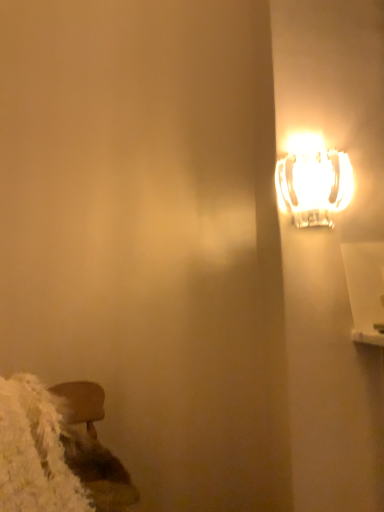
Question: Considering the relative sizes of wooden stool at lower left and translucent glass lamp at upper right in the image provided, is wooden stool at lower left wider than translucent glass lamp at upper right?

Choices:
 (A) yes
 (B) no

Answer: (A)

Question: Is wooden stool at lower left closer to camera compared to translucent glass lamp at upper right?

Choices:
 (A) yes
 (B) no

Answer: (A)

Question: Is wooden stool at lower left located outside translucent glass lamp at upper right?

Choices:
 (A) no
 (B) yes

Answer: (B)

Question: Is wooden stool at lower left bigger than translucent glass lamp at upper right?

Choices:
 (A) yes
 (B) no

Answer: (A)

Question: Can you confirm if wooden stool at lower left is smaller than translucent glass lamp at upper right?

Choices:
 (A) no
 (B) yes

Answer: (A)

Question: Is wooden stool at lower left not close to translucent glass lamp at upper right?

Choices:
 (A) yes
 (B) no

Answer: (B)

Question: Considering the relative sizes of translucent glass lamp at upper right and wooden stool at lower left in the image provided, is translucent glass lamp at upper right taller than wooden stool at lower left?

Choices:
 (A) yes
 (B) no

Answer: (B)

Question: Can wooden stool at lower left be found inside translucent glass lamp at upper right?

Choices:
 (A) no
 (B) yes

Answer: (A)

Question: From a real-world perspective, is translucent glass lamp at upper right on wooden stool at lower left?

Choices:
 (A) yes
 (B) no

Answer: (A)

Question: Can you confirm if translucent glass lamp at upper right is smaller than wooden stool at lower left?

Choices:
 (A) no
 (B) yes

Answer: (B)

Question: Would you say translucent glass lamp at upper right is outside wooden stool at lower left?

Choices:
 (A) no
 (B) yes

Answer: (B)

Question: Would you say translucent glass lamp at upper right is a long distance from wooden stool at lower left?

Choices:
 (A) yes
 (B) no

Answer: (B)

Question: Is wooden stool at lower left wider or thinner than translucent glass lamp at upper right?

Choices:
 (A) thin
 (B) wide

Answer: (B)